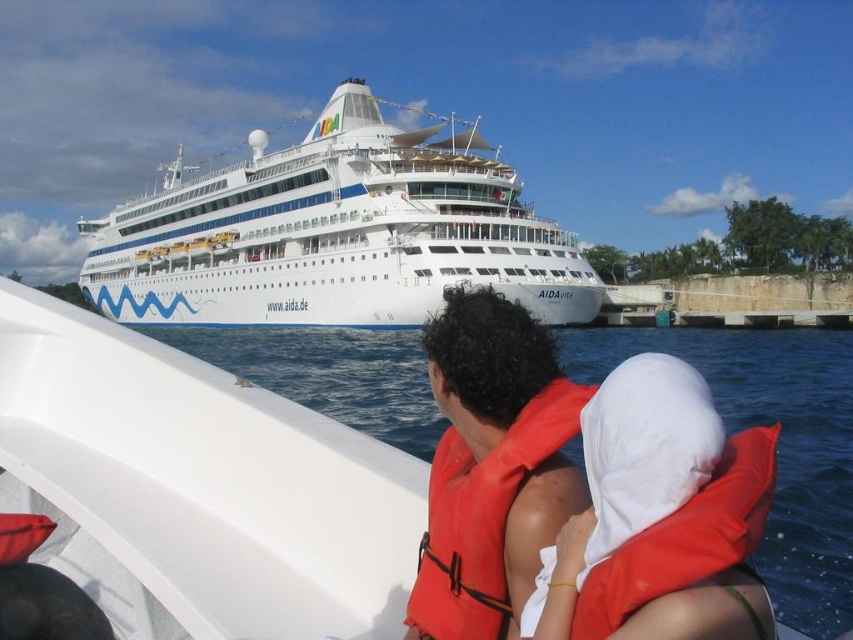
The width and height of the screenshot is (853, 640). Describe the element at coordinates (482, 516) in the screenshot. I see `orange fabric life jacket at center` at that location.

Is orange fabric life jacket at center smaller than orange life jacket at center?

Yes.

Which is behind, point (422, 540) or point (759, 515)?

The point (422, 540) is behind.

I want to click on orange fabric life jacket at center, so click(x=482, y=516).

Does white plastic boat at center have a greater width compared to orange life jacket at center?

Correct, the width of white plastic boat at center exceeds that of orange life jacket at center.

Between white plastic boat at center and orange life jacket at center, which one is positioned lower?

Positioned lower is white plastic boat at center.

Identify the location of white plastic boat at center. This screenshot has width=853, height=640. (200, 484).

Does white glossy cruise ship at upper center have a lesser width compared to orange fabric life jacket at center?

No.

Which is more to the left, white glossy cruise ship at upper center or orange fabric life jacket at center?

white glossy cruise ship at upper center is more to the left.

This screenshot has height=640, width=853. Describe the element at coordinates (334, 234) in the screenshot. I see `white glossy cruise ship at upper center` at that location.

This screenshot has width=853, height=640. What are the coordinates of `white glossy cruise ship at upper center` in the screenshot? It's located at (334, 234).